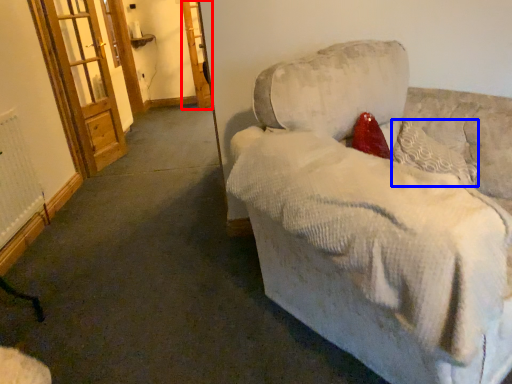
Question: Among these objects, which one is nearest to the camera, screen door (highlighted by a red box) or pillow (highlighted by a blue box)?

Choices:
 (A) screen door
 (B) pillow

Answer: (B)